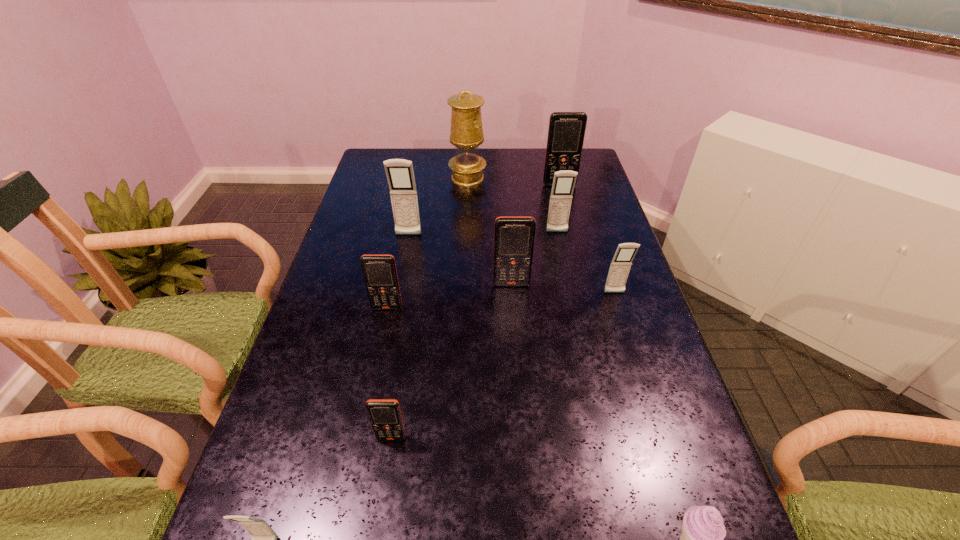
Where is `the third farthest orange cellular telephone`? the third farthest orange cellular telephone is located at coordinates (379, 271).

Where is `the third biggest orange cellular telephone`? The image size is (960, 540). the third biggest orange cellular telephone is located at coordinates (379, 271).

Locate an element on the screen. This screenshot has height=540, width=960. the seventh farthest cellular telephone is located at coordinates (385, 416).

Where is `the smallest orange cellular telephone`? Image resolution: width=960 pixels, height=540 pixels. the smallest orange cellular telephone is located at coordinates (385, 416).

This screenshot has width=960, height=540. I want to click on free region located on the right of the tallest object, so click(x=500, y=178).

Find the location of a particular element. vacant space positioned 0.180m on the screen of the farthest cellular telephone is located at coordinates (567, 216).

You are a GUI agent. You are given a task and a screenshot of the screen. Output one action in this format:
    pyautogui.click(x=<x>, y=<y>)
    Task: Click on the vacant area located on the front-facing side of the second gray cellular telephone from left to right
    
    Given the screenshot: What is the action you would take?
    pyautogui.click(x=402, y=269)

Where is `vacant space located 0.100m on the front-facing side of the second gray cellular telephone from right to left`? Image resolution: width=960 pixels, height=540 pixels. vacant space located 0.100m on the front-facing side of the second gray cellular telephone from right to left is located at coordinates (562, 255).

You are a GUI agent. You are given a task and a screenshot of the screen. Output one action in this format:
    pyautogui.click(x=<x>, y=<y>)
    Task: Click on the vacant space situated on the screen of the fourth cellular telephone from right to left
    The image size is (960, 540).
    Given the screenshot: What is the action you would take?
    pyautogui.click(x=517, y=366)

Find the location of a particular element. Image resolution: width=960 pixels, height=540 pixels. vacant space located 0.100m on the front-facing side of the second smallest gray cellular telephone is located at coordinates (624, 324).